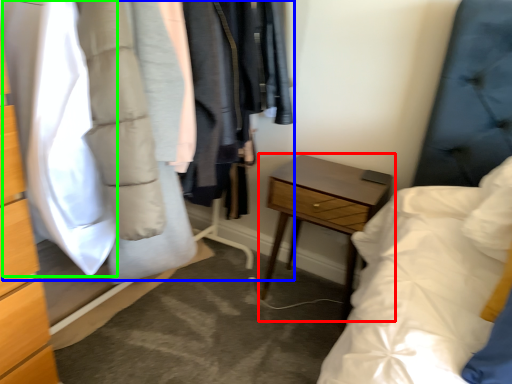
Question: Estimate the real-world distances between objects in this image. Which object is farther from nightstand (highlighted by a red box), closet (highlighted by a blue box) or clothing (highlighted by a green box)?

Choices:
 (A) closet
 (B) clothing

Answer: (B)